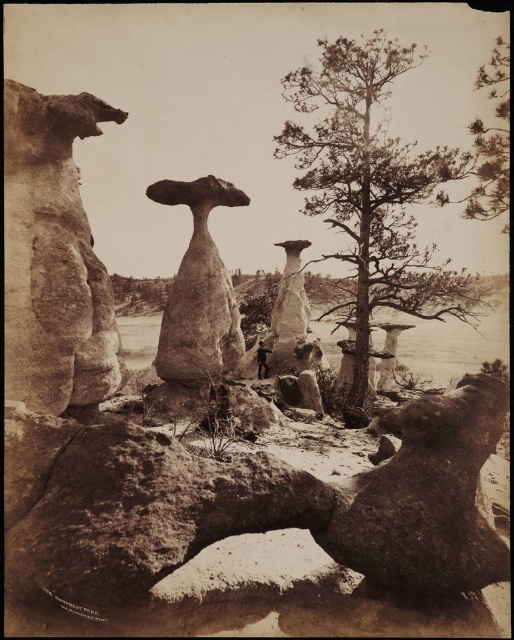
Question: Which point appears farthest from the camera in this image?

Choices:
 (A) (211, 266)
 (B) (31, 348)
 (C) (391, 288)

Answer: (C)

Question: Can you confirm if smooth sandstone toadstool at left is smaller than smooth sandstone toadstool at center?

Choices:
 (A) yes
 (B) no

Answer: (A)

Question: Which of the following is the closest to the observer?

Choices:
 (A) smooth sandstone toadstool at left
 (B) smooth sandstone toadstool at center

Answer: (A)

Question: Among these objects, which one is nearest to the camera?

Choices:
 (A) green textured tree at center
 (B) smooth sandstone toadstool at center
 (C) smooth sandstone toadstool at left

Answer: (C)

Question: Can you confirm if smooth sandstone toadstool at left is bigger than smooth sandstone toadstool at center?

Choices:
 (A) no
 (B) yes

Answer: (A)

Question: Is smooth sandstone toadstool at left behind smooth sandstone toadstool at center?

Choices:
 (A) yes
 (B) no

Answer: (B)